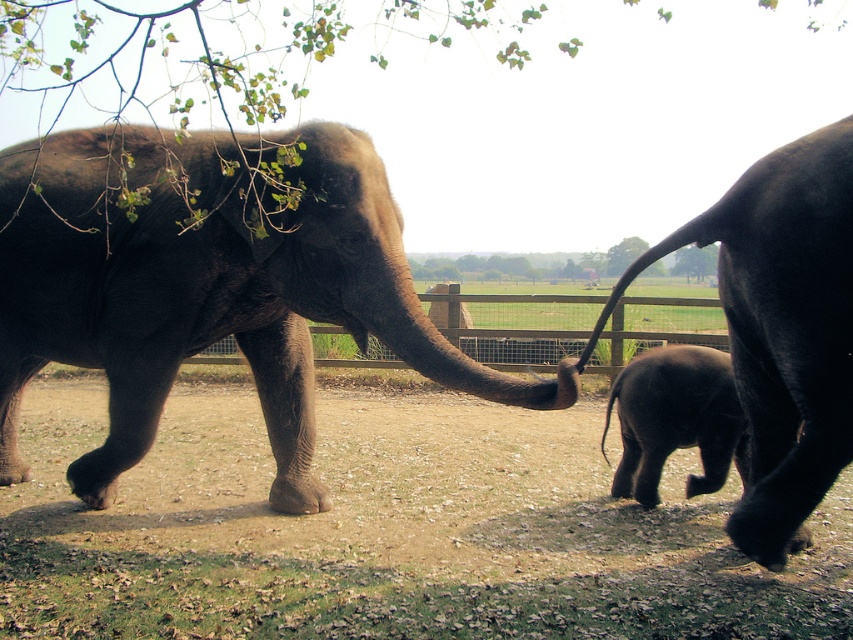
Which is behind, point (503, 396) or point (757, 273)?

Positioned behind is point (503, 396).

Who is higher up, dark brown wrinkled elephant at left or dark gray wrinkled elephant at right?

dark brown wrinkled elephant at left

Who is more forward, (x=106, y=323) or (x=753, y=528)?

Point (x=753, y=528) is in front.

Where is `dark brown wrinkled elephant at left`? The width and height of the screenshot is (853, 640). dark brown wrinkled elephant at left is located at coordinates (207, 291).

Is dark gray wrinkled elephant at right shorter than green leafy tree at upper center?

No, dark gray wrinkled elephant at right is not shorter than green leafy tree at upper center.

Is dark gray wrinkled elephant at right positioned behind green leafy tree at upper center?

No, it is not.

Locate an element on the screen. The height and width of the screenshot is (640, 853). dark gray wrinkled elephant at right is located at coordinates (782, 326).

Is dark brown wrinkled skin baby elephant at center wider than green leafy tree at upper center?

Yes, dark brown wrinkled skin baby elephant at center is wider than green leafy tree at upper center.

Which is more to the right, dark brown wrinkled skin baby elephant at center or green leafy tree at upper center?

From the viewer's perspective, green leafy tree at upper center appears more on the right side.

In order to click on dark brown wrinkled skin baby elephant at center in this screenshot , I will do `click(676, 419)`.